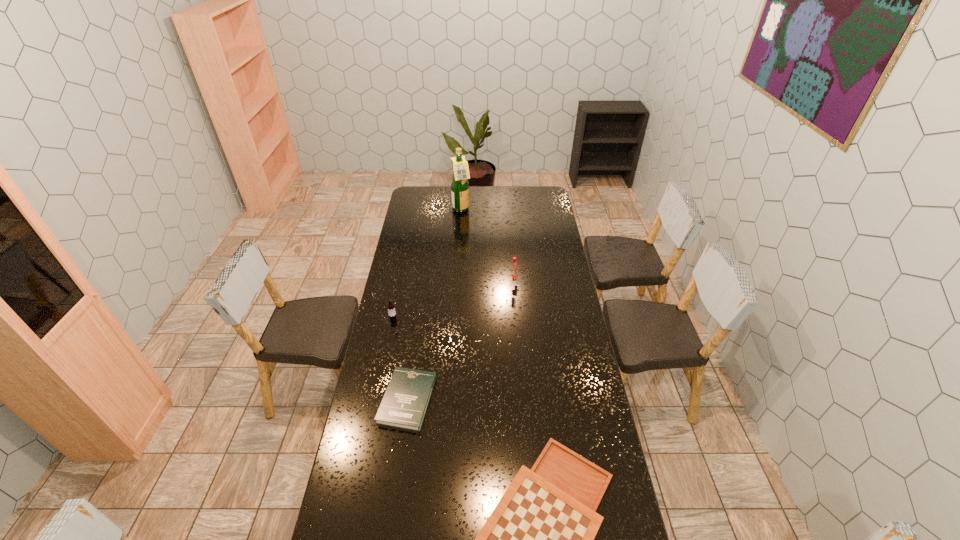
Locate an element on the screen. the farthest object is located at coordinates (459, 185).

In order to click on liquor in this screenshot , I will do `click(459, 185)`.

Identify the location of the fourth nearest object. This screenshot has height=540, width=960. (513, 274).

You are a GUI agent. You are given a task and a screenshot of the screen. Output one action in this format:
    pyautogui.click(x=<x>, y=<y>)
    Task: Click on the second tallest object
    
    Given the screenshot: What is the action you would take?
    pyautogui.click(x=513, y=274)

Where is `the nearer root beer`? This screenshot has width=960, height=540. the nearer root beer is located at coordinates (391, 307).

Find the location of a particular element. the third shortest object is located at coordinates click(391, 307).

Find the location of `book`. book is located at coordinates (405, 402).

This screenshot has height=540, width=960. Identify the location of free space located 0.060m on the front-facing side of the tallest object. (481, 210).

This screenshot has width=960, height=540. What are the coordinates of `free space located on the back of the second farthest object` in the screenshot? It's located at (509, 235).

You are a GUI agent. You are given a task and a screenshot of the screen. Output one action in this format:
    pyautogui.click(x=<x>, y=<y>)
    Task: Click on the vacant area situated on the right of the third tallest object
    The height and width of the screenshot is (540, 960).
    Given the screenshot: What is the action you would take?
    pyautogui.click(x=479, y=319)